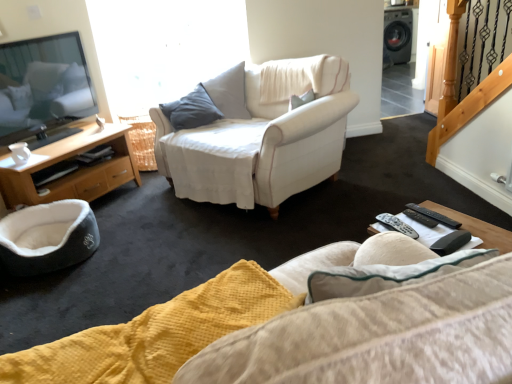
Question: Can you confirm if wooden cabinet at left is positioned to the right of black plastic remote control at lower right?

Choices:
 (A) yes
 (B) no

Answer: (B)

Question: Can you confirm if wooden cabinet at left is shorter than black plastic remote control at lower right?

Choices:
 (A) no
 (B) yes

Answer: (A)

Question: Is wooden cabinet at left facing towards black plastic remote control at lower right?

Choices:
 (A) yes
 (B) no

Answer: (A)

Question: Considering the relative sizes of wooden cabinet at left and black plastic remote control at lower right in the image provided, is wooden cabinet at left wider than black plastic remote control at lower right?

Choices:
 (A) yes
 (B) no

Answer: (A)

Question: From a real-world perspective, is wooden cabinet at left located beneath black plastic remote control at lower right?

Choices:
 (A) yes
 (B) no

Answer: (A)

Question: From a real-world perspective, relative to black plastic remote control at lower right, is black plastic remote at lower right, the 1th remote when ordered from left to right, vertically above or below?

Choices:
 (A) above
 (B) below

Answer: (A)

Question: Is black plastic remote at lower right, positioned as the third remote in right-to-left order, bigger or smaller than black plastic remote control at lower right?

Choices:
 (A) big
 (B) small

Answer: (B)

Question: Is point (388, 218) positioned closer to the camera than point (480, 235)?

Choices:
 (A) closer
 (B) farther

Answer: (B)

Question: Is black plastic remote at lower right, the 1th remote when ordered from left to right, spatially inside black plastic remote control at lower right, or outside of it?

Choices:
 (A) inside
 (B) outside

Answer: (A)

Question: In terms of size, does black plastic remote at lower right, the 1th remote when ordered from left to right, appear bigger or smaller than white fabric chair at center?

Choices:
 (A) small
 (B) big

Answer: (A)

Question: Looking at their shapes, would you say black plastic remote at lower right, positioned as the third remote in right-to-left order, is wider or thinner than white fabric chair at center?

Choices:
 (A) wide
 (B) thin

Answer: (B)

Question: From a real-world perspective, is black plastic remote at lower right, positioned as the third remote in right-to-left order, above or below white fabric chair at center?

Choices:
 (A) below
 (B) above

Answer: (B)

Question: Does point 387,213 appear closer or farther from the camera than point 308,127?

Choices:
 (A) closer
 (B) farther

Answer: (A)

Question: Does point (412, 231) appear closer or farther from the camera than point (424, 213)?

Choices:
 (A) farther
 (B) closer

Answer: (B)

Question: From the image's perspective, relative to black plastic remote at lower right, which is the first remote in right-to-left order, is black plastic remote at lower right, positioned as the third remote in right-to-left order, above or below?

Choices:
 (A) above
 (B) below

Answer: (B)